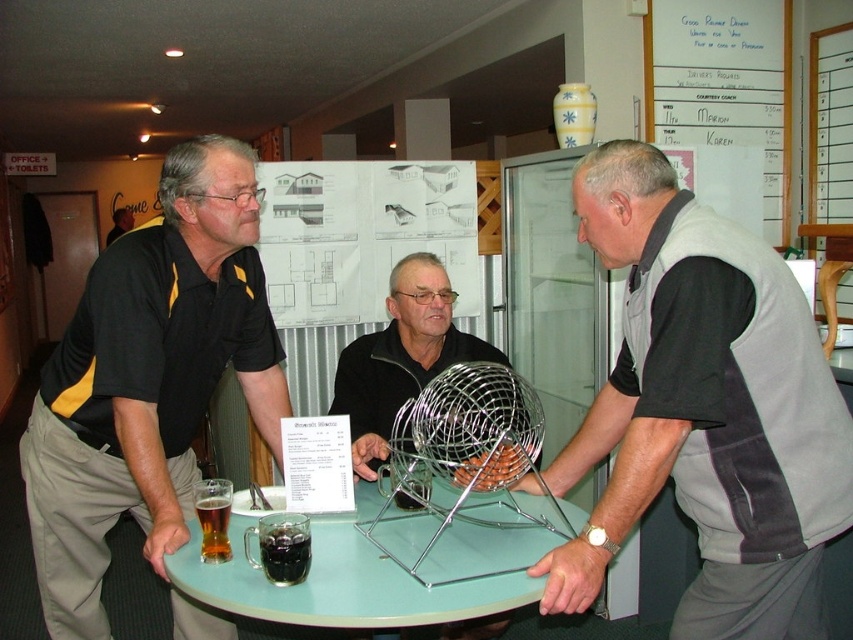
You are a photographer setting up a tripod to capture a shot of the gray fabric vest at center and the translucent glass mug at lower left. The tripod has a height adjustment feature. If you want both objects to be in focus and at the same focal plane, which object should you adjust the tripod height to match?

The gray fabric vest at center is taller than the translucent glass mug at lower left. To ensure both are in focus and at the same focal plane, adjust the tripod height to match the height of the gray fabric vest at center so the mug at lower left will be adequately framed without being out of focus.

Looking at this image, you are a person who is 5 feet tall and standing in the room. You want to pick up the metallic wire ball at center. Can you reach it?

The metallic wire ball at center is 6.08 feet away from the viewer. Since the person is 5 feet tall, they may not be able to reach it unless they move closer or use a tool.

You are a guest at this community center and want to place a small item on the table without it falling off. Considering the translucent glass table at center and the metallic wire ball at center, which object should you place the item on?

You should place the item on the translucent glass table at center because the metallic wire ball at center is positioned above it, so the table is the stable surface.